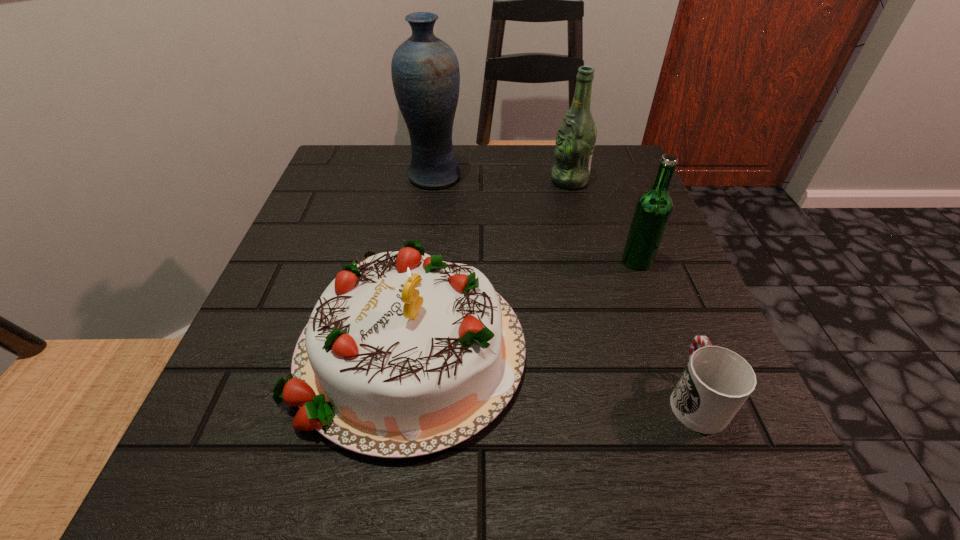
Where is `the tallest object`? the tallest object is located at coordinates (425, 72).

I want to click on the third object from left to right, so click(x=576, y=136).

Locate an element on the screen. This screenshot has width=960, height=540. the farther beer bottle is located at coordinates (576, 136).

The width and height of the screenshot is (960, 540). I want to click on the nearer beer bottle, so click(x=653, y=209).

Locate an element on the screen. the right beer bottle is located at coordinates (653, 209).

Identify the location of cake. The image size is (960, 540). (x=404, y=355).

Identify the location of the shortest object. (716, 382).

The height and width of the screenshot is (540, 960). Identify the location of vacant region located 0.360m on the front of the vase. (414, 322).

This screenshot has width=960, height=540. Identify the location of free region located on the surface of the farther beer bottle. (443, 181).

At what (x,y) coordinates should I click in order to perform the action: click on free space located 0.370m on the surface of the farther beer bottle. Please return your answer as a coordinate pair (x, y). The height and width of the screenshot is (540, 960). Looking at the image, I should click on (384, 181).